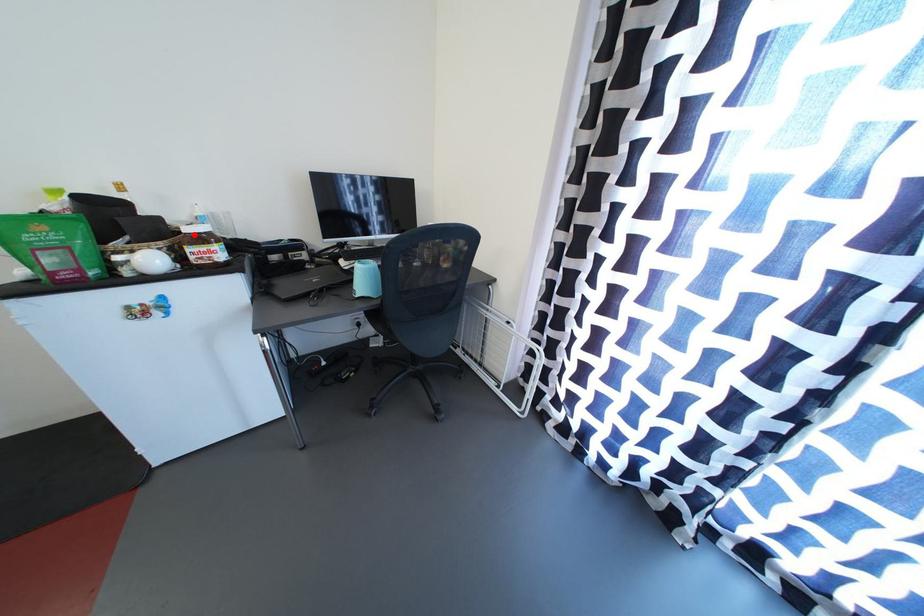
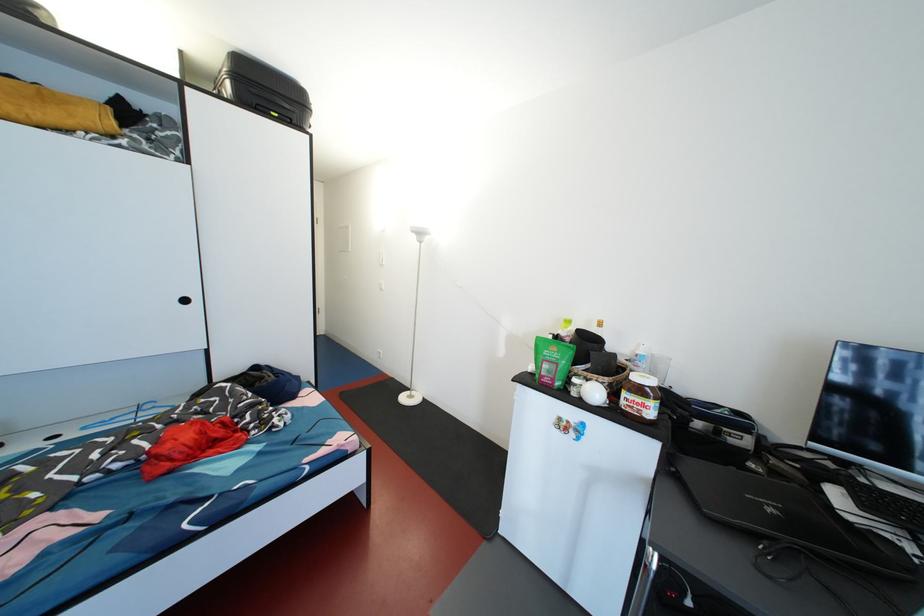
The point at the highlighted location is marked in the first image. Where is the corresponding point in the second image?

(641, 383)